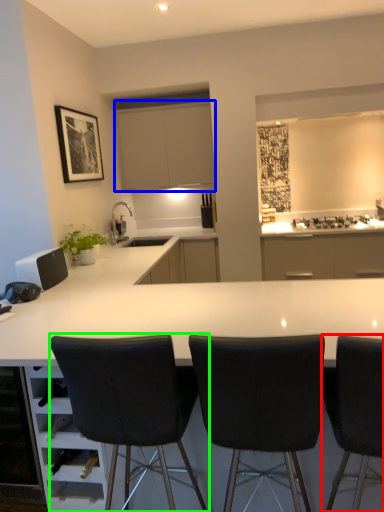
Question: Which object is positioned closest to chair (highlighted by a red box)? Select from cabinetry (highlighted by a blue box) and chair (highlighted by a green box).

Choices:
 (A) cabinetry
 (B) chair

Answer: (B)